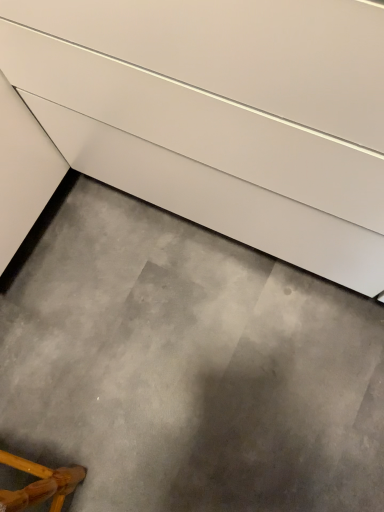
Question: Considering the relative positions of gray concrete at lower center and wooden chair at lower left in the image provided, is gray concrete at lower center to the right of wooden chair at lower left from the viewer's perspective?

Choices:
 (A) yes
 (B) no

Answer: (A)

Question: Is the surface of gray concrete at lower center in direct contact with wooden chair at lower left?

Choices:
 (A) no
 (B) yes

Answer: (A)

Question: Is gray concrete at lower center positioned far away from wooden chair at lower left?

Choices:
 (A) yes
 (B) no

Answer: (B)

Question: Can you confirm if gray concrete at lower center is wider than wooden chair at lower left?

Choices:
 (A) no
 (B) yes

Answer: (B)

Question: Is gray concrete at lower center taller than wooden chair at lower left?

Choices:
 (A) no
 (B) yes

Answer: (A)

Question: Is gray concrete at lower center aimed at wooden chair at lower left?

Choices:
 (A) no
 (B) yes

Answer: (A)

Question: Is wooden chair at lower left facing towards gray concrete at lower center?

Choices:
 (A) no
 (B) yes

Answer: (A)

Question: Is wooden chair at lower left to the right of gray concrete at lower center from the viewer's perspective?

Choices:
 (A) yes
 (B) no

Answer: (B)

Question: Is wooden chair at lower left surrounding gray concrete at lower center?

Choices:
 (A) yes
 (B) no

Answer: (B)

Question: From a real-world perspective, is wooden chair at lower left beneath gray concrete at lower center?

Choices:
 (A) no
 (B) yes

Answer: (A)

Question: Is wooden chair at lower left behind gray concrete at lower center?

Choices:
 (A) yes
 (B) no

Answer: (B)

Question: From the image's perspective, is wooden chair at lower left located above gray concrete at lower center?

Choices:
 (A) no
 (B) yes

Answer: (A)

Question: From a real-world perspective, does wooden chair at lower left stand above white glossy drawer at upper center?

Choices:
 (A) yes
 (B) no

Answer: (B)